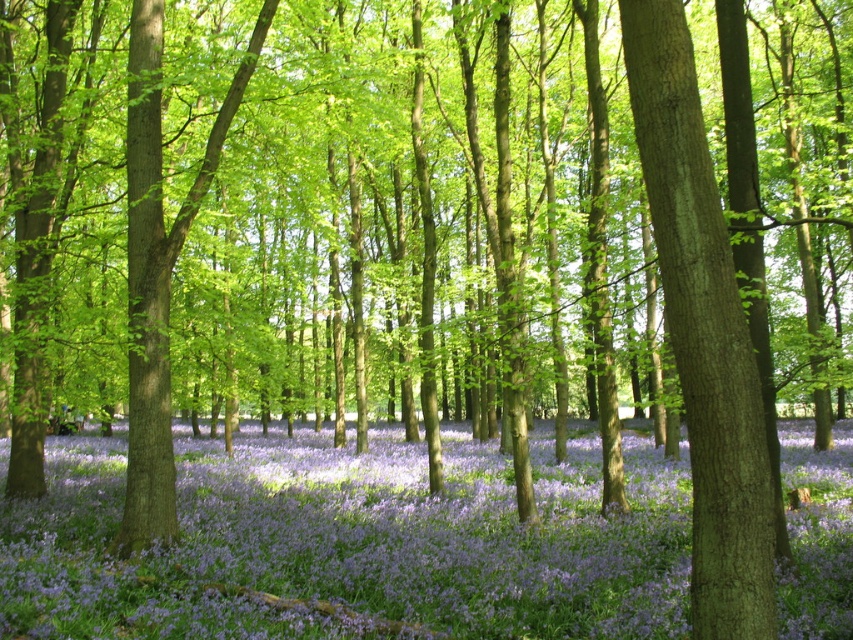
You are standing at the point marked as point (364,500) in the forest. You want to reach a clearing that is exactly 50 feet away from your current position. Can you safely walk straight ahead without encountering any obstacles? Please explain your reasoning based on the scene description.

The distance between you and the clearing is 50 feet. The objects description states that the point (364,500) is 47.53 feet apart from another point. Since 47.53 feet is less than 50 feet, it is possible that the path ahead is clear for at least 47.53 feet, but there might be an obstacle beyond that distance. Therefore, you might encounter an obstacle before reaching the clearing.

You are standing in the forest and see the purple matte flower at center. If you move 0.1 units to the right along the x axis, will you be closer to the flower?

Moving 0.1 units to the right along the x axis would take you to x coordinate 0.950, which is further away from the purple matte flower at center located at x coordinate 0.850. Therefore, you would be farther from the flower.